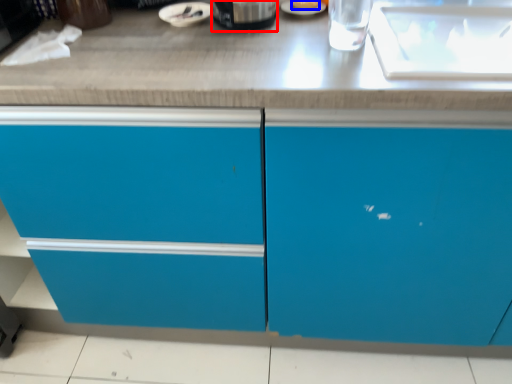
Question: Which point is further to the camera, appliance (highlighted by a red box) or food (highlighted by a blue box)?

Choices:
 (A) appliance
 (B) food

Answer: (B)